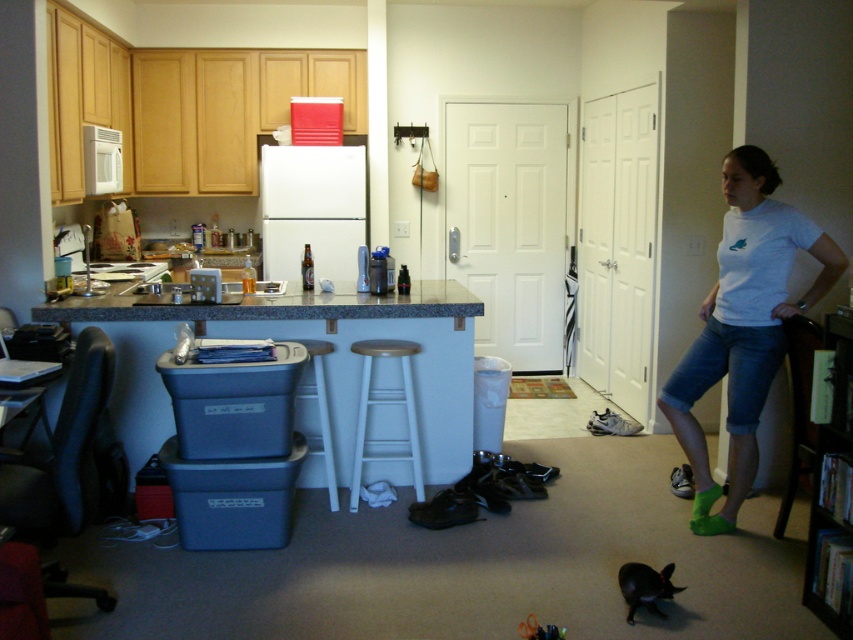
Question: Which point is closer to the camera taking this photo?

Choices:
 (A) (815, 285)
 (B) (332, 456)
 (C) (361, 340)

Answer: (A)

Question: Where is white painted wood bar stool at center located in relation to white wood bar stool at center in the image?

Choices:
 (A) right
 (B) left

Answer: (A)

Question: Which object is the closest to the white t-shirt at right?

Choices:
 (A) white painted wood bar stool at center
 (B) white wood bar stool at center

Answer: (A)

Question: Does white t-shirt at right appear under white wood bar stool at center?

Choices:
 (A) no
 (B) yes

Answer: (A)

Question: Is white t-shirt at right closer to the viewer compared to white wood bar stool at center?

Choices:
 (A) yes
 (B) no

Answer: (A)

Question: Which of these objects is positioned farthest from the white wood bar stool at center?

Choices:
 (A) white painted wood bar stool at center
 (B) white t-shirt at right

Answer: (B)